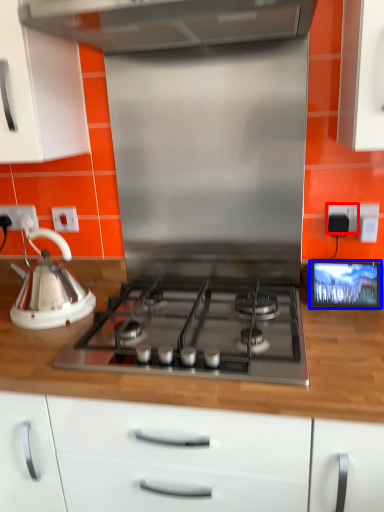
Question: Which of the following is the farthest to the observer, electric outlet (highlighted by a red box) or screen (highlighted by a blue box)?

Choices:
 (A) electric outlet
 (B) screen

Answer: (A)